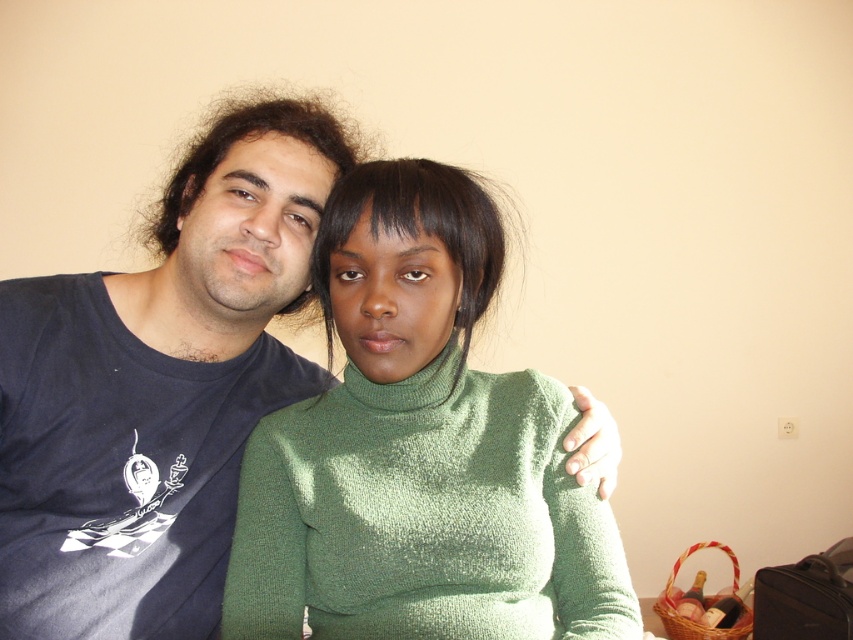
Between green knitted sweater at center and dark blue t-shirt at left, which one appears on the right side from the viewer's perspective?

From the viewer's perspective, green knitted sweater at center appears more on the right side.

Does green knitted sweater at center come behind dark blue t-shirt at left?

That is False.

This screenshot has height=640, width=853. Describe the element at coordinates (418, 451) in the screenshot. I see `green knitted sweater at center` at that location.

Locate an element on the screen. green knitted sweater at center is located at coordinates (418, 451).